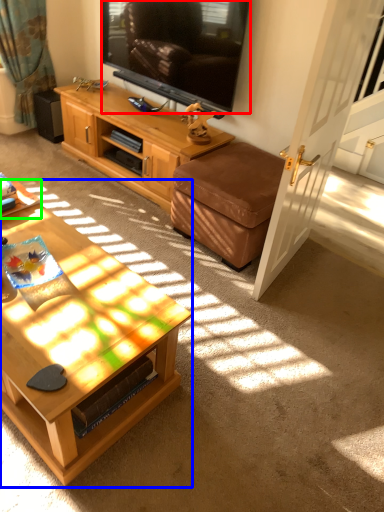
Question: Which is farther away from television (highlighted by a red box)? coffee table (highlighted by a blue box) or desk (highlighted by a green box)?

Choices:
 (A) coffee table
 (B) desk

Answer: (A)